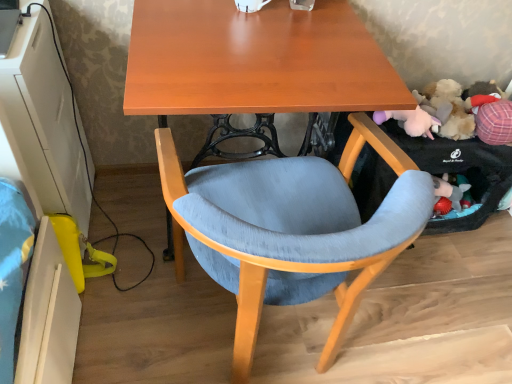
Where is `vacant space in between matte wood desk at center and white glossy computer desk at lower left`? The image size is (512, 384). vacant space in between matte wood desk at center and white glossy computer desk at lower left is located at coordinates (129, 224).